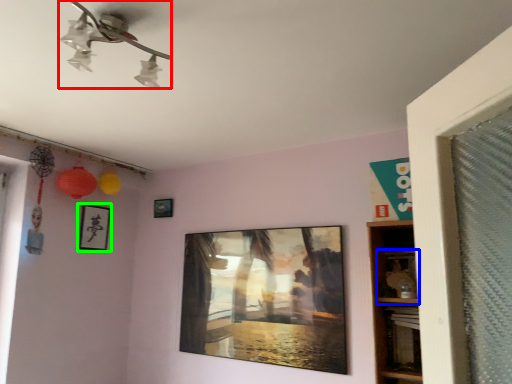
Question: Based on their relative distances, which object is farther from lamp (highlighted by a red box)? Choose from shelf (highlighted by a blue box) and picture frame (highlighted by a green box).

Choices:
 (A) shelf
 (B) picture frame

Answer: (B)